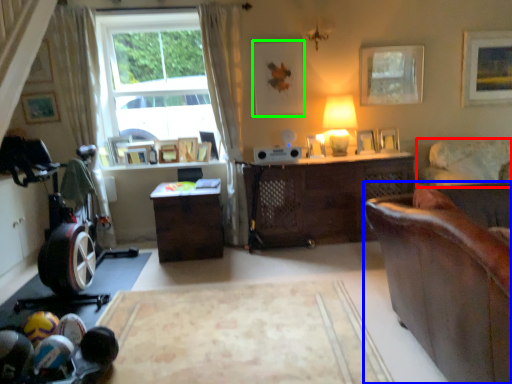
Question: Estimate the real-world distances between objects in this image. Which object is farther from studio couch (highlighted by a red box), studio couch (highlighted by a blue box) or picture frame (highlighted by a green box)?

Choices:
 (A) studio couch
 (B) picture frame

Answer: (A)